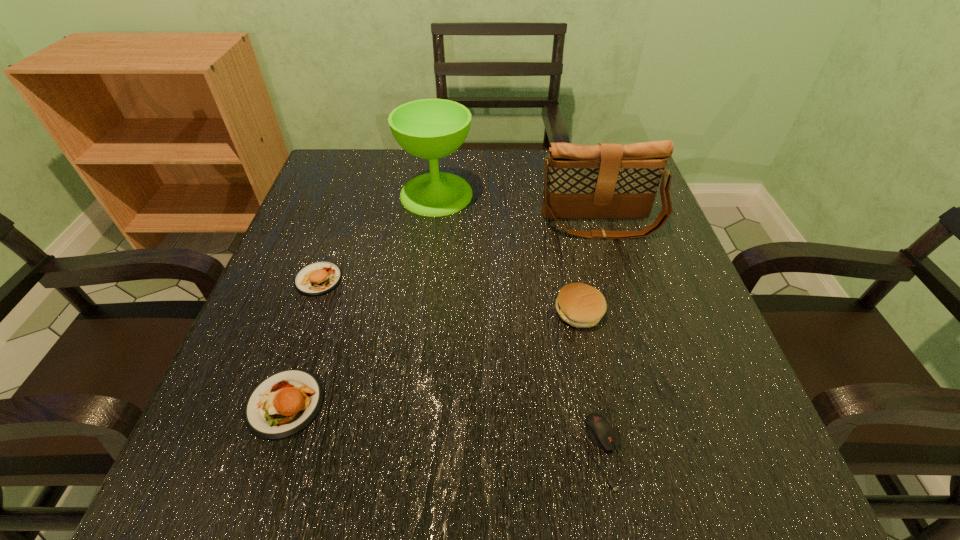
Identify the location of blank space located on the right of the mouse. The width and height of the screenshot is (960, 540). (719, 452).

The image size is (960, 540). I want to click on object present at the far edge, so click(x=431, y=129).

Locate an element on the screen. The image size is (960, 540). patty (food) positioned at the near edge is located at coordinates (283, 404).

Where is `mouse that is positioned at the near edge`? Image resolution: width=960 pixels, height=540 pixels. mouse that is positioned at the near edge is located at coordinates (601, 433).

Locate an element on the screen. object located in the right edge section of the desktop is located at coordinates (605, 181).

You are a GUI agent. You are given a task and a screenshot of the screen. Output one action in this format:
    pyautogui.click(x=<x>, y=<y>)
    Task: Click on the object that is at the near left corner
    This screenshot has height=540, width=960.
    Given the screenshot: What is the action you would take?
    pyautogui.click(x=283, y=404)

Identify the location of vacant space at the far edge of the desktop. This screenshot has height=540, width=960. 480,180.

This screenshot has height=540, width=960. In order to click on free space at the near edge of the desktop in this screenshot , I will do `click(391, 463)`.

Identify the location of blank space at the left edge of the desktop. The width and height of the screenshot is (960, 540). (365, 227).

Locate an element on the screen. This screenshot has height=540, width=960. vacant space at the right edge is located at coordinates (704, 340).